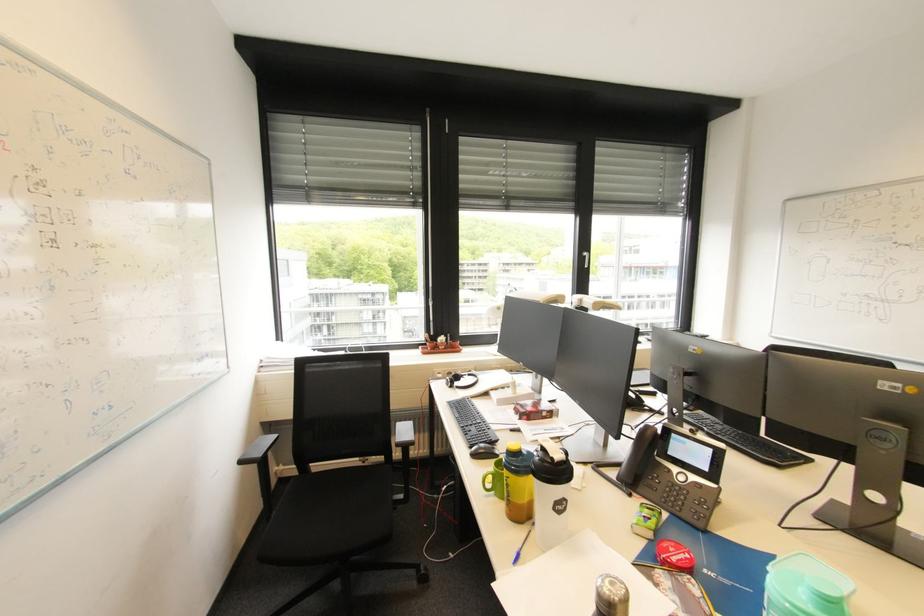
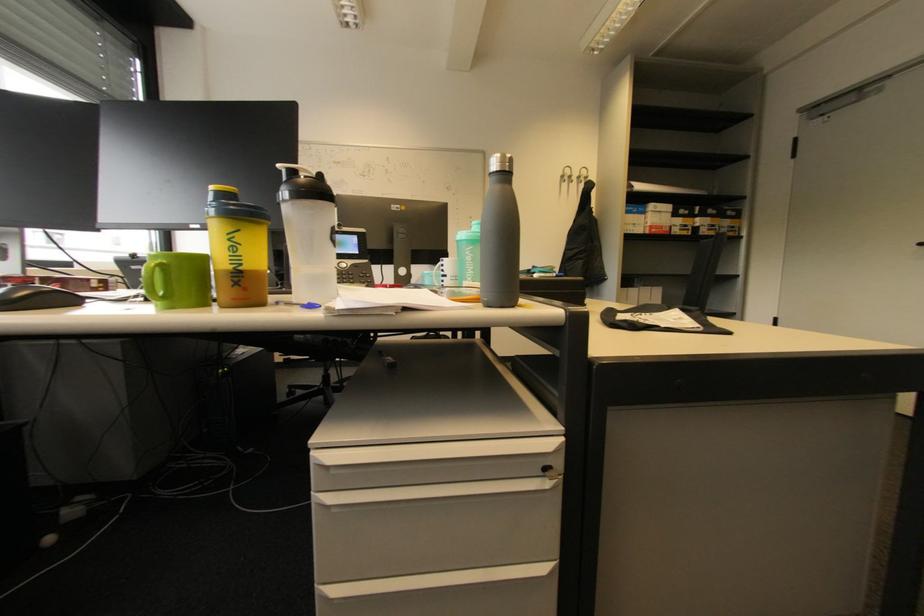
Question: The camera is either moving clockwise (left) or counter-clockwise (right) around the object. The first image is from the beginning of the video and the second image is from the end. Is the camera moving left or right when shooting the video?

Choices:
 (A) Left
 (B) Right

Answer: (A)